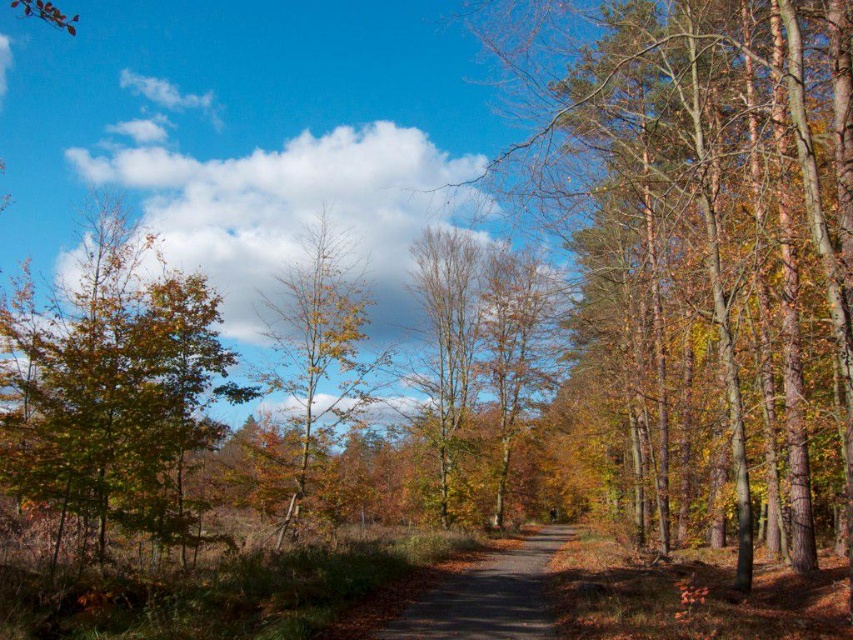
Does brown smooth tree at center have a larger size compared to brown asphalt path at center?

No.

Does brown smooth tree at center appear over brown asphalt path at center?

Yes.

The width and height of the screenshot is (853, 640). What are the coordinates of `brown smooth tree at center` in the screenshot? It's located at (448, 339).

Is smooth bark tree at center wider than green matte tree at center?

Yes, smooth bark tree at center is wider than green matte tree at center.

Does smooth bark tree at center appear on the left side of green matte tree at center?

Incorrect, smooth bark tree at center is not on the left side of green matte tree at center.

Is point (659, 81) positioned behind point (369, 396)?

No, it is not.

You are a GUI agent. You are given a task and a screenshot of the screen. Output one action in this format:
    pyautogui.click(x=<x>, y=<y>)
    Task: Click on the smooth bark tree at center
    
    Given the screenshot: What is the action you would take?
    pyautogui.click(x=715, y=244)

How much distance is there between green matte tree at center and brown asphalt path at center?

A distance of 6.84 meters exists between green matte tree at center and brown asphalt path at center.

I want to click on green matte tree at center, so (x=318, y=353).

Locate an element on the screen. green matte tree at center is located at coordinates pyautogui.click(x=318, y=353).